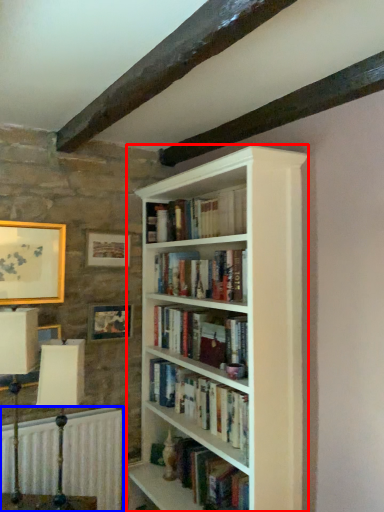
Question: Among these objects, which one is nearest to the camera, bookcase (highlighted by a red box) or radiator (highlighted by a blue box)?

Choices:
 (A) bookcase
 (B) radiator

Answer: (A)